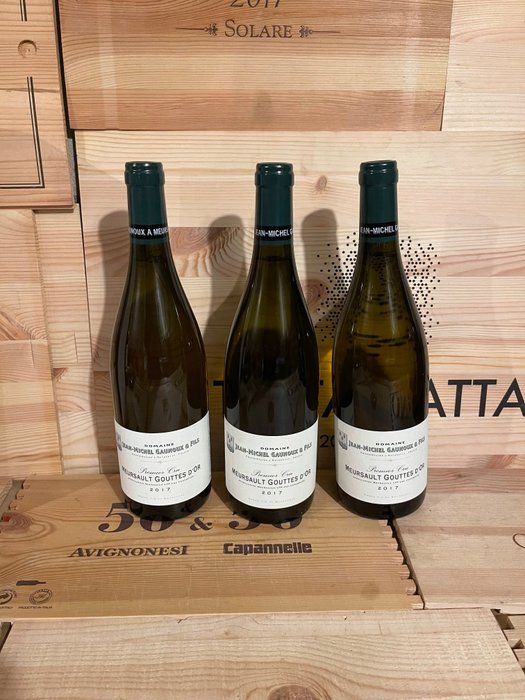
Where is `3 wine bottles`? The image size is (525, 700). 3 wine bottles is located at coordinates (165, 382), (264, 354), (387, 348).